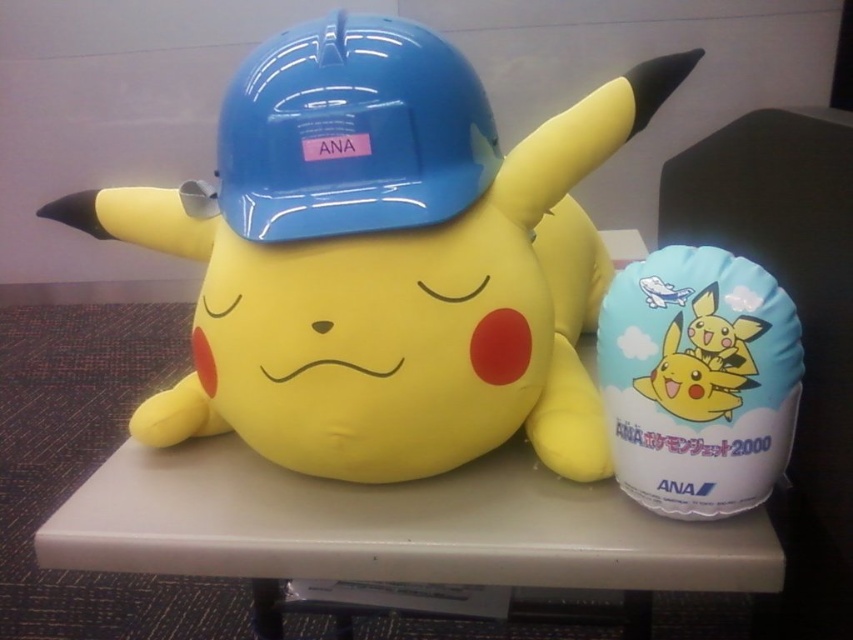
Question: Is matte plastic pikachu at center bigger than white fabric balloon at right?

Choices:
 (A) no
 (B) yes

Answer: (B)

Question: Among these points, which one is nearest to the camera?

Choices:
 (A) (399, 132)
 (B) (486, 256)

Answer: (A)

Question: Is matte plastic pikachu at center smaller than white matte table at center?

Choices:
 (A) yes
 (B) no

Answer: (B)

Question: Which point is closer to the camera?

Choices:
 (A) blue hard hat at center
 (B) white fabric balloon at right

Answer: (B)

Question: Which is nearer to the matte plastic pikachu at center?

Choices:
 (A) white matte table at center
 (B) white fabric balloon at right

Answer: (A)

Question: Is white matte table at center wider than white fabric balloon at right?

Choices:
 (A) no
 (B) yes

Answer: (B)